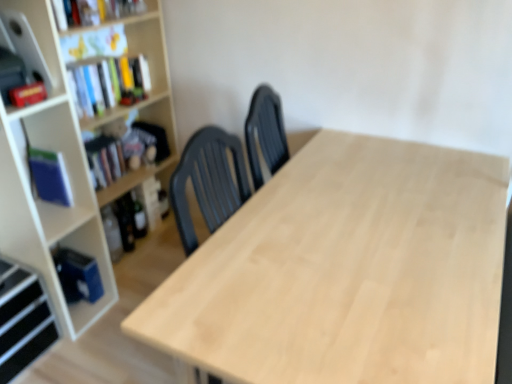
Question: Considering the positions of hardcover book at left, the second book ordered from the bottom, and blue matte book at left, arranged as the first book when ordered from the bottom, in the image, is hardcover book at left, the second book ordered from the bottom, bigger or smaller than blue matte book at left, arranged as the first book when ordered from the bottom,?

Choices:
 (A) big
 (B) small

Answer: (A)

Question: Is hardcover book at left, the second book ordered from the bottom, in front of or behind blue matte book at left, arranged as the first book when ordered from the bottom, in the image?

Choices:
 (A) front
 (B) behind

Answer: (B)

Question: Which object is positioned closest to the blue matte book at left, arranged as the first book when ordered from the bottom?

Choices:
 (A) matte white cabinet at upper left
 (B) hardcover book at left, the 2th book from the top
 (C) black plastic shelf at lower left, which is the first shelf from bottom to top
 (D) wooden bookcase at left
 (E) hardcover book at upper left, which is counted as the third book, starting from the bottom

Answer: (D)

Question: Based on their relative distances, which object is farther from the light wood table at center?

Choices:
 (A) wooden bookshelf at upper left, the first shelf from the top
 (B) matte white cabinet at upper left
 (C) blue matte book at left, which is the third book in top-to-bottom order
 (D) hardcover book at left, the 2th book from the top
 (E) black plastic shelf at lower left, which ranks as the second shelf in right-to-left order

Answer: (A)